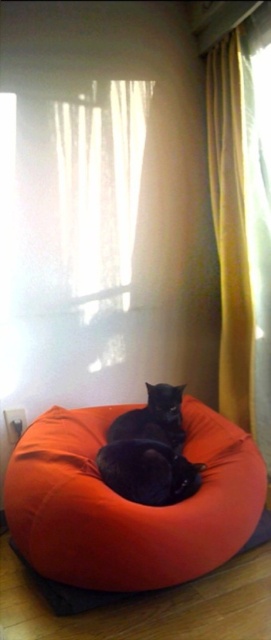
You are standing in the room and want to reach the yellow fabric curtain at right. The coordinates given are point (240, 236). Can you confirm if this point is located on the yellow fabric curtain at right?

Yes, the point (240, 236) is located on the yellow fabric curtain at right as stated in the description.

You are a cat owner who wants to ensure your cat can reach the yellow fabric curtain at right from the black matte cat at center. Given that the cat can jump 30 inches, will it be able to reach the curtain?

The yellow fabric curtain at right and black matte cat at center are 31.21 inches apart from each other. Since the cat can jump 30 inches, it cannot reach the curtain as the distance is slightly more than its jumping capability.

You are a painter who wants to paint the yellow fabric curtain at right and the black matte cat at center. Which object requires a larger canvas area to capture its full width?

The black matte cat at center requires a larger canvas area because it has a greater width than the yellow fabric curtain at right.